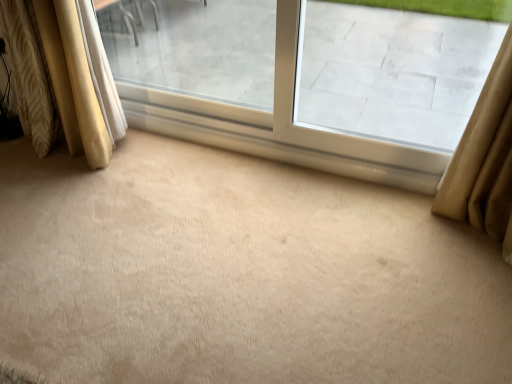
Where is `transparent glass window at center`? Image resolution: width=512 pixels, height=384 pixels. transparent glass window at center is located at coordinates (254, 80).

What do you see at coordinates (393, 72) in the screenshot?
I see `transparent glass window at upper right` at bounding box center [393, 72].

Find the location of a particular element. This screenshot has height=384, width=512. transparent glass window at center is located at coordinates (254, 80).

How different are the orientations of transparent glass window at center and transparent glass window at upper right in degrees?

0.609 degrees separate the facing orientations of transparent glass window at center and transparent glass window at upper right.

Does transparent glass window at center have a greater width compared to transparent glass window at upper right?

Yes.

Based on their sizes in the image, would you say transparent glass window at center is bigger or smaller than transparent glass window at upper right?

transparent glass window at center is bigger than transparent glass window at upper right.

Between transparent glass window at center and transparent glass window at upper right, which one appears on the right side from the viewer's perspective?

From the viewer's perspective, transparent glass window at upper right appears more on the right side.

Is beige fabric curtain at left, arranged as the 1th curtain when viewed from the right, facing towards transparent glass window at center?

No, beige fabric curtain at left, arranged as the 1th curtain when viewed from the right, is not oriented towards transparent glass window at center.

Do you think beige fabric curtain at left, arranged as the 1th curtain when viewed from the right, is within transparent glass window at center, or outside of it?

beige fabric curtain at left, arranged as the 1th curtain when viewed from the right, is not enclosed by transparent glass window at center.

How many degrees apart are the facing directions of beige fabric curtain at left, the second curtain when ordered from left to right, and transparent glass window at center?

There is a 1.37-degree angle between the facing directions of beige fabric curtain at left, the second curtain when ordered from left to right, and transparent glass window at center.

Identify the location of window lying below the beige fabric curtain at left, arranged as the 1th curtain when viewed from the right (from the image's perspective). This screenshot has height=384, width=512. (254, 80).

From the image's perspective, is beige fabric curtain at left, the second curtain when ordered from left to right, under transparent glass window at upper right?

Incorrect, from the image's perspective, beige fabric curtain at left, the second curtain when ordered from left to right, is higher than transparent glass window at upper right.

Does beige fabric curtain at left, the second curtain when ordered from left to right, touch transparent glass window at upper right?

No, beige fabric curtain at left, the second curtain when ordered from left to right, is not making contact with transparent glass window at upper right.

Image resolution: width=512 pixels, height=384 pixels. I want to click on window screen below the beige fabric curtain at left, the second curtain when ordered from left to right (from the image's perspective), so click(393, 72).

From the image's perspective, which one is positioned higher, woven fabric curtain at left, acting as the 2th curtain starting from the right, or transparent glass window at center?

From the image's view, woven fabric curtain at left, acting as the 2th curtain starting from the right, is above.

In the scene shown: From a real-world perspective, who is located higher, woven fabric curtain at left, which is the 1th curtain in left-to-right order, or transparent glass window at center?

From a 3D spatial view, transparent glass window at center is above.

Is woven fabric curtain at left, which is the 1th curtain in left-to-right order, not near transparent glass window at center?

Yes, woven fabric curtain at left, which is the 1th curtain in left-to-right order, is far from transparent glass window at center.

Which of these two, woven fabric curtain at left, acting as the 2th curtain starting from the right, or transparent glass window at center, is wider?

woven fabric curtain at left, acting as the 2th curtain starting from the right.

Looking at this image, is woven fabric curtain at left, acting as the 2th curtain starting from the right, not close to transparent glass window at upper right?

Yes, woven fabric curtain at left, acting as the 2th curtain starting from the right, is far from transparent glass window at upper right.

Considering the positions of point (28, 102) and point (475, 40), is point (28, 102) closer or farther from the camera than point (475, 40)?

Point (28, 102) appears to be closer to the viewer than point (475, 40).

From a real-world perspective, is woven fabric curtain at left, which is the 1th curtain in left-to-right order, physically located above or below transparent glass window at upper right?

From a real-world perspective, woven fabric curtain at left, which is the 1th curtain in left-to-right order, is physically below transparent glass window at upper right.

Between transparent glass window at upper right and beige fabric curtain at left, the second curtain when ordered from left to right, which one has larger width?

beige fabric curtain at left, the second curtain when ordered from left to right.

The image size is (512, 384). I want to click on the 1st curtain to the left when counting from the transparent glass window at upper right, so click(62, 77).

Is transparent glass window at upper right not inside beige fabric curtain at left, arranged as the 1th curtain when viewed from the right?

That's correct, transparent glass window at upper right is outside of beige fabric curtain at left, arranged as the 1th curtain when viewed from the right.

Could you measure the distance between transparent glass window at center and woven fabric curtain at left, acting as the 2th curtain starting from the right?

transparent glass window at center and woven fabric curtain at left, acting as the 2th curtain starting from the right, are 5.17 feet apart.

Is point (245, 54) closer to camera compared to point (39, 107)?

That is False.

Is transparent glass window at center turned away from woven fabric curtain at left, acting as the 2th curtain starting from the right?

transparent glass window at center is not turned away from woven fabric curtain at left, acting as the 2th curtain starting from the right.

Considering the sizes of transparent glass window at center and woven fabric curtain at left, which is the 1th curtain in left-to-right order, in the image, is transparent glass window at center wider or thinner than woven fabric curtain at left, which is the 1th curtain in left-to-right order,?

Considering their sizes, transparent glass window at center looks slimmer than woven fabric curtain at left, which is the 1th curtain in left-to-right order.

At what (x,y) coordinates should I click in order to perform the action: click on window that is on the left side of transparent glass window at upper right. Please return your answer as a coordinate pair (x, y). Image resolution: width=512 pixels, height=384 pixels. Looking at the image, I should click on (254, 80).

Find the location of a particular element. This screenshot has height=384, width=512. window above the beige fabric curtain at left, the second curtain when ordered from left to right (from a real-world perspective) is located at coordinates (254, 80).

Based on their spatial positions, is transparent glass window at center or woven fabric curtain at left, which is the 1th curtain in left-to-right order, closer to transparent glass window at upper right?

transparent glass window at center is positioned closer to the anchor transparent glass window at upper right.

Considering their positions, is beige fabric curtain at left, arranged as the 1th curtain when viewed from the right, positioned further to transparent glass window at upper right than woven fabric curtain at left, acting as the 2th curtain starting from the right?

Among the two, woven fabric curtain at left, acting as the 2th curtain starting from the right, is located further to transparent glass window at upper right.

Based on the photo, looking at the image, which one is located closer to woven fabric curtain at left, which is the 1th curtain in left-to-right order, beige fabric curtain at left, the second curtain when ordered from left to right, or transparent glass window at upper right?

Based on the image, beige fabric curtain at left, the second curtain when ordered from left to right, appears to be nearer to woven fabric curtain at left, which is the 1th curtain in left-to-right order.

From the image, which object appears to be farther from beige fabric curtain at left, arranged as the 1th curtain when viewed from the right, transparent glass window at upper right or transparent glass window at center?

Based on the image, transparent glass window at upper right appears to be further to beige fabric curtain at left, arranged as the 1th curtain when viewed from the right.

Looking at the image, which one is located further to woven fabric curtain at left, which is the 1th curtain in left-to-right order, transparent glass window at upper right or transparent glass window at center?

The object further to woven fabric curtain at left, which is the 1th curtain in left-to-right order, is transparent glass window at upper right.

Looking at the image, which one is located further to transparent glass window at center, beige fabric curtain at left, the second curtain when ordered from left to right, or woven fabric curtain at left, which is the 1th curtain in left-to-right order?

Among the two, woven fabric curtain at left, which is the 1th curtain in left-to-right order, is located further to transparent glass window at center.

From the image, which object appears to be nearer to transparent glass window at upper right, woven fabric curtain at left, which is the 1th curtain in left-to-right order, or beige fabric curtain at left, arranged as the 1th curtain when viewed from the right?

beige fabric curtain at left, arranged as the 1th curtain when viewed from the right, lies closer to transparent glass window at upper right than the other object.

Looking at the image, which one is located further to transparent glass window at center, transparent glass window at upper right or beige fabric curtain at left, the second curtain when ordered from left to right?

Based on the image, beige fabric curtain at left, the second curtain when ordered from left to right, appears to be further to transparent glass window at center.

At what (x,y) coordinates should I click in order to perform the action: click on curtain between woven fabric curtain at left, acting as the 2th curtain starting from the right, and transparent glass window at center, in the horizontal direction. Please return your answer as a coordinate pair (x, y). This screenshot has height=384, width=512. Looking at the image, I should click on (62, 77).

I want to click on curtain between woven fabric curtain at left, acting as the 2th curtain starting from the right, and transparent glass window at upper right, in the horizontal direction, so click(x=62, y=77).

Identify the location of window between woven fabric curtain at left, acting as the 2th curtain starting from the right, and transparent glass window at upper right from left to right. This screenshot has height=384, width=512. (254, 80).

This screenshot has height=384, width=512. What are the coordinates of `window between beige fabric curtain at left, the second curtain when ordered from left to right, and transparent glass window at upper right` in the screenshot? It's located at (254, 80).